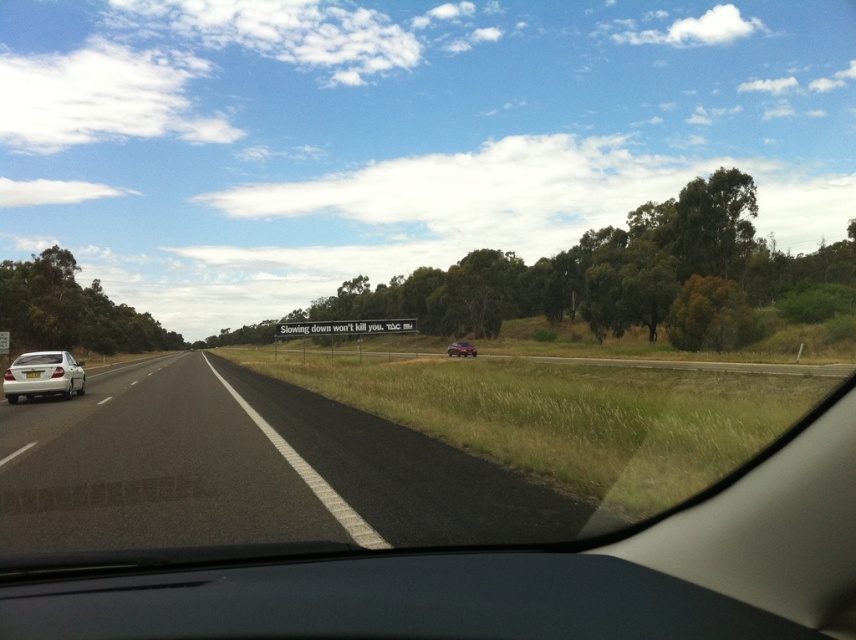
Question: Is dark gray plastic dashboard at lower center smaller than metallic silver car at center?

Choices:
 (A) yes
 (B) no

Answer: (A)

Question: From the image, what is the correct spatial relationship of silver metallic sedan at left in relation to metallic silver car at center?

Choices:
 (A) above
 (B) below

Answer: (B)

Question: Which point appears farthest from the camera in this image?

Choices:
 (A) (22, 369)
 (B) (129, 588)
 (C) (262, 474)
 (D) (462, 342)

Answer: (D)

Question: Among these points, which one is nearest to the camera?

Choices:
 (A) (513, 595)
 (B) (467, 353)
 (C) (165, 394)
 (D) (9, 381)

Answer: (A)

Question: Which point is closer to the camera?

Choices:
 (A) (471, 346)
 (B) (16, 368)

Answer: (B)

Question: Can you confirm if black asphalt road at center is positioned above dark gray plastic dashboard at lower center?

Choices:
 (A) yes
 (B) no

Answer: (B)